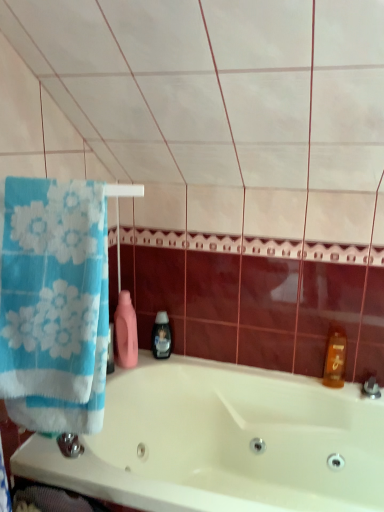
Image resolution: width=384 pixels, height=512 pixels. In order to click on vacant space in between black plastic soap dispenser at center and translucent amber bottle at right in this screenshot , I will do `click(239, 373)`.